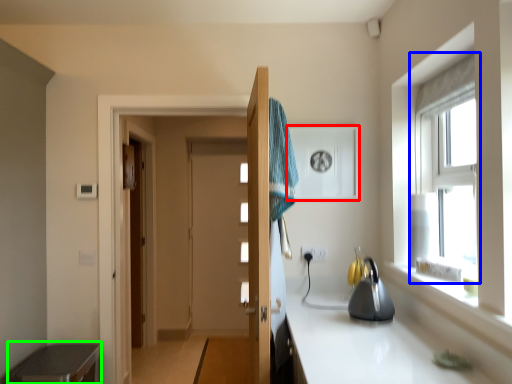
Question: Which object is the closest to the medicine cabinet (highlighted by a red box)? Choose among these: window (highlighted by a blue box) or cabinetry (highlighted by a green box).

Choices:
 (A) window
 (B) cabinetry

Answer: (A)